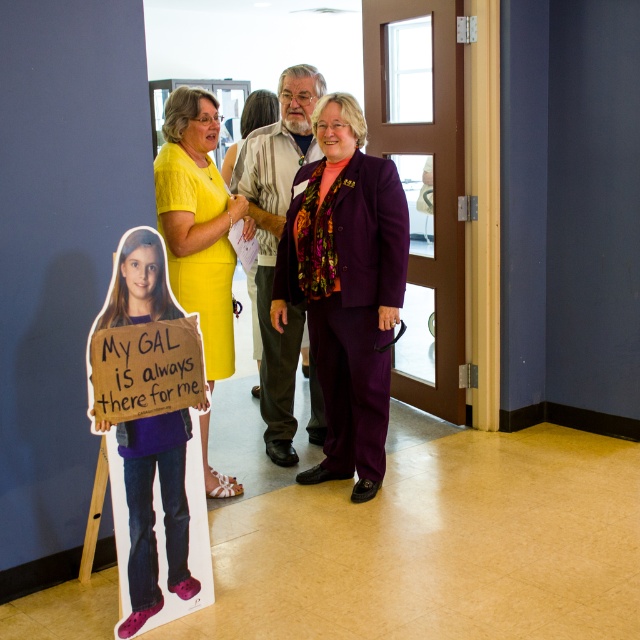
Question: Which of the following is the farthest from the observer?

Choices:
 (A) (186, 170)
 (B) (260, 182)
 (C) (330, 458)
 (D) (250, 272)

Answer: (D)

Question: Does yellow fabric dress at center appear under yellow satin dress at center?

Choices:
 (A) yes
 (B) no

Answer: (A)

Question: Is purple fabric suit at center below yellow fabric dress at center?

Choices:
 (A) no
 (B) yes

Answer: (B)

Question: Which point appears closest to the camera in this image?

Choices:
 (A) (262, 116)
 (B) (390, 195)

Answer: (B)

Question: Among these points, which one is farthest from the camera?

Choices:
 (A) (125, 292)
 (B) (252, 308)
 (C) (266, 196)

Answer: (B)

Question: Can you confirm if purple satin suit at center is smaller than multicolored patterned suit at center?

Choices:
 (A) no
 (B) yes

Answer: (B)